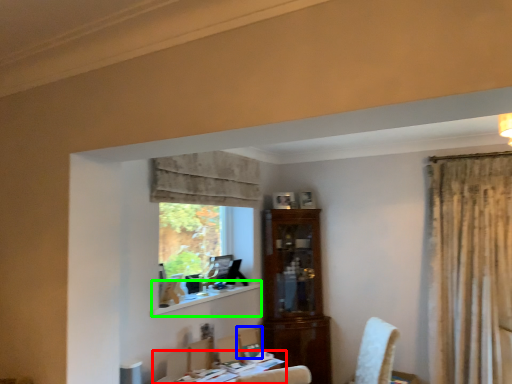
Question: Considering the real-world distances, which object is farthest from table (highlighted by a red box)? chair (highlighted by a blue box) or window sill (highlighted by a green box)?

Choices:
 (A) chair
 (B) window sill

Answer: (B)